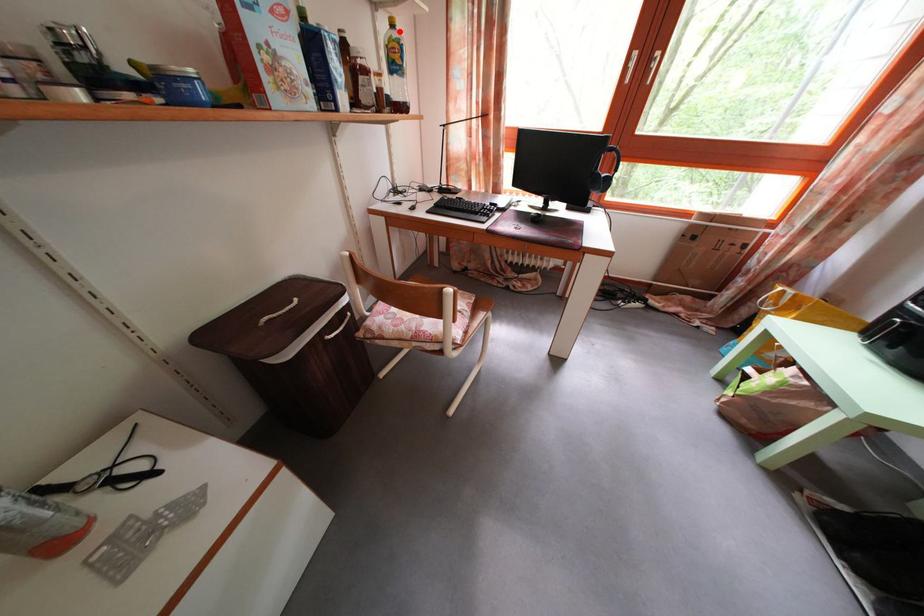
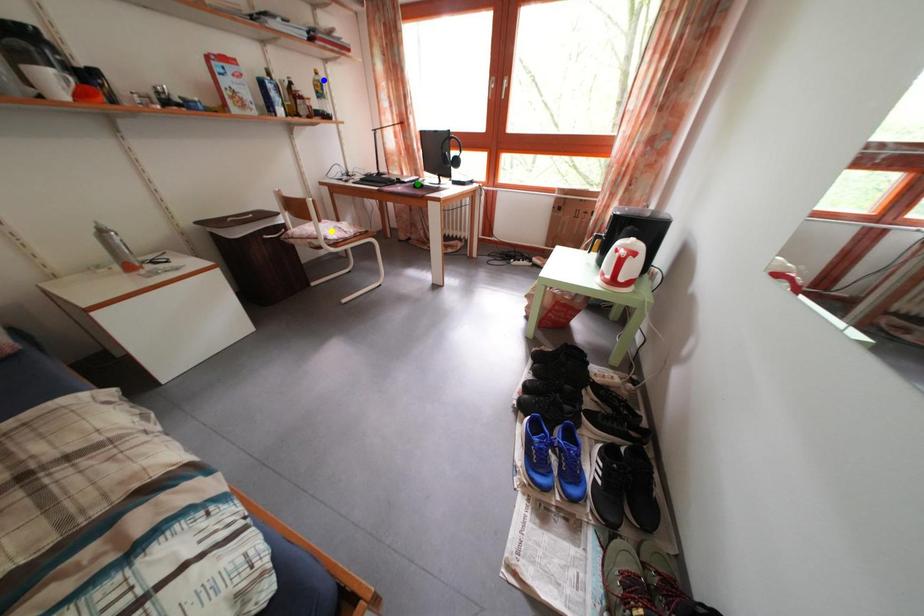
Question: I am providing you with two images of the same scene from different viewpoints. A red point is marked on the first image. You are given multiple points on the second image. Which point in image 2 is actually the same real-world point as the red point in image 1?

Choices:
 (A) green point
 (B) yellow point
 (C) blue point

Answer: (C)